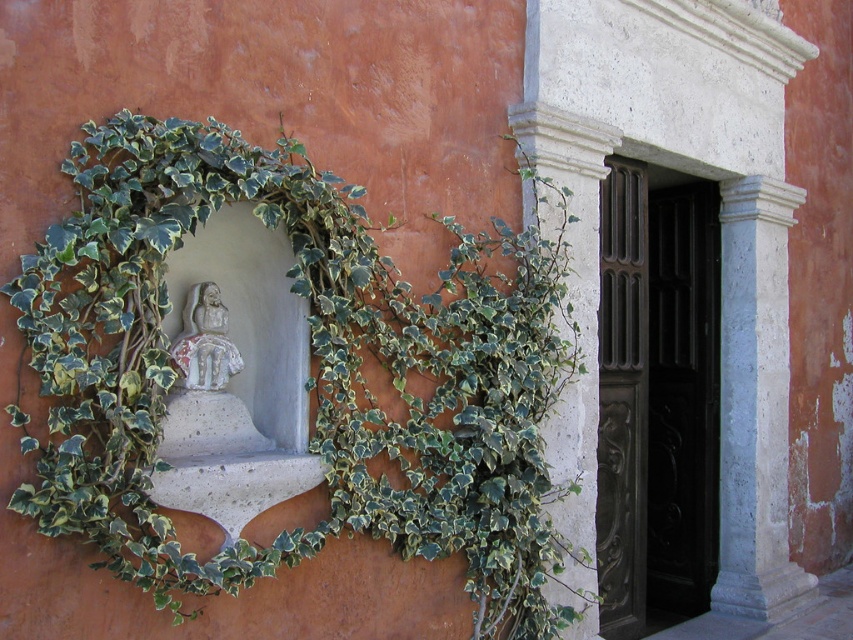
You are standing in front of a building and see the green leafy ivy at left and the white stone pillar at right. Which object is closer to the entrance of the building?

The green leafy ivy at left is closer to the entrance since it is positioned to the left of the white stone pillar at right, which is further away from the entrance.

You are standing in front of the building exterior described. You want to place a 10 foot ladder against the wall between the green leafy ivy at left and the door. Is there enough space for the ladder?

The distance between the green leafy ivy at left and the viewer is 8.68 feet. Since the ladder is 10 feet long, it would extend beyond the available space, so placing it there may not be safe or feasible.

You are standing in front of the building exterior described. You want to place a small potted plant between the green leafy ivy at left and the white stone pillar at right. Based on their positions, where should you place the potted plant?

The green leafy ivy at left is positioned under the white stone pillar at right, so placing the potted plant between them would mean placing it between the green leafy ivy at left and the white stone pillar at right, under the pillar.